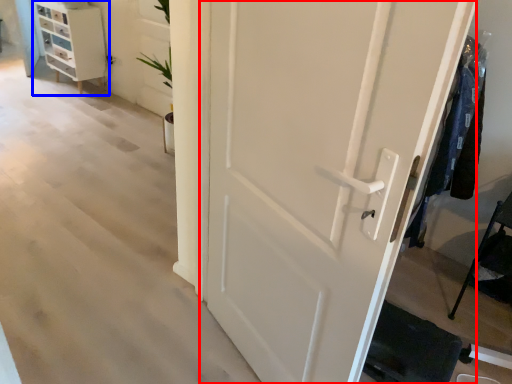
Question: Among these objects, which one is farthest to the camera, door (highlighted by a red box) or chest of drawers (highlighted by a blue box)?

Choices:
 (A) door
 (B) chest of drawers

Answer: (B)